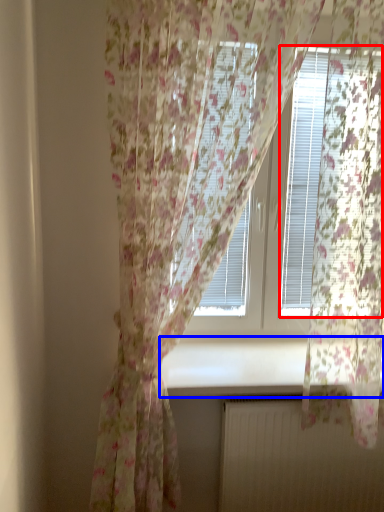
Question: Which of the following is the farthest to the observer, blind (highlighted by a red box) or window sill (highlighted by a blue box)?

Choices:
 (A) blind
 (B) window sill

Answer: (B)